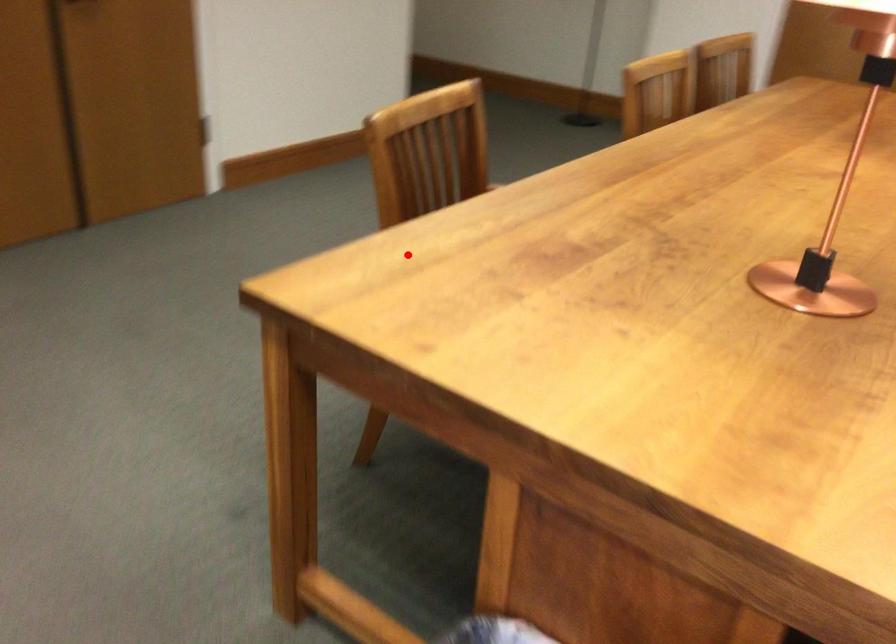
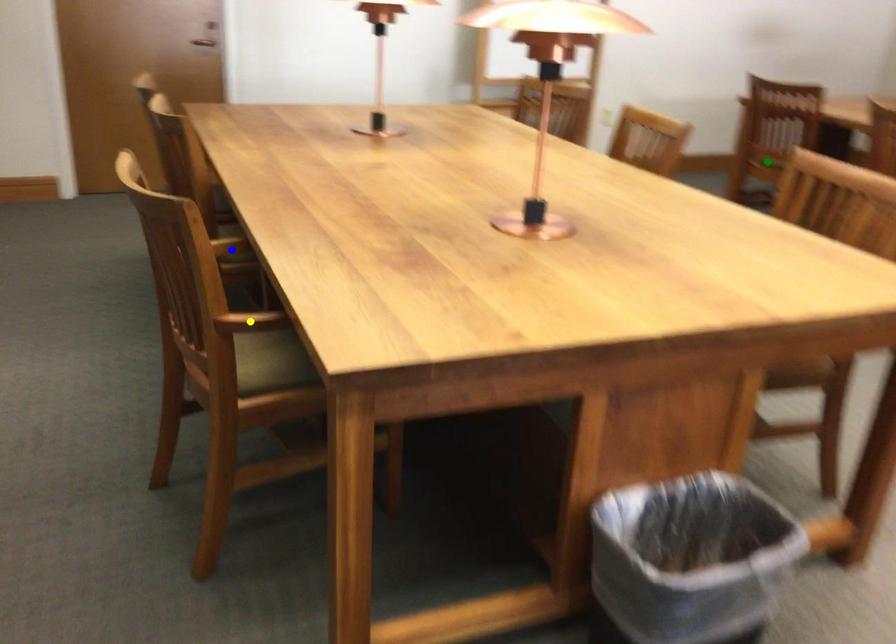
Question: I am providing you with two images of the same scene from different viewpoints. A red point is marked on the first image. You are given multiple points on the second image. Which mark in image 2 goes with the point in image 1?

Choices:
 (A) blue point
 (B) green point
 (C) yellow point

Answer: (C)